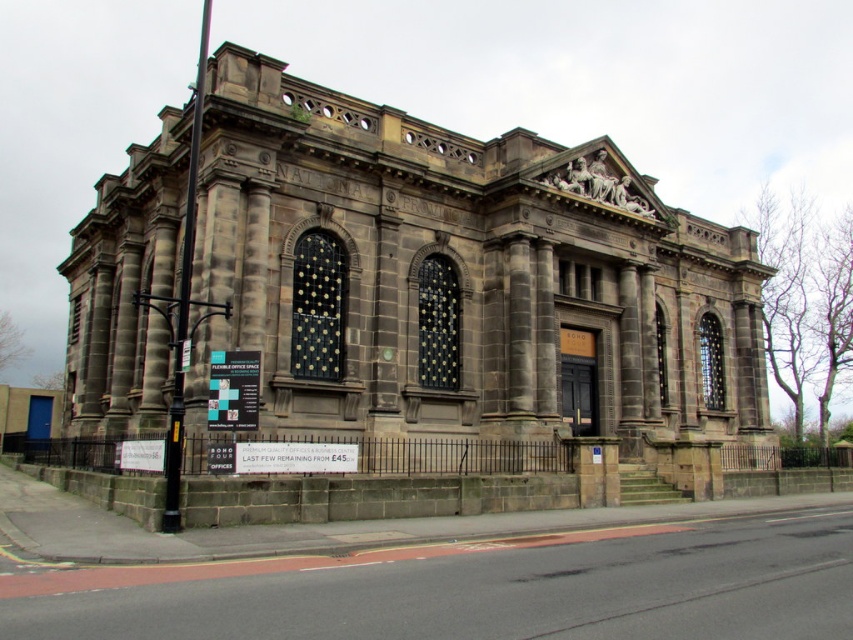
Is dark gray stone church at center positioned behind white plastic sign at lower left?

No.

Is dark gray stone church at center positioned before white plastic sign at lower left?

Yes, dark gray stone church at center is closer to the viewer.

Identify the location of dark gray stone church at center. (461, 280).